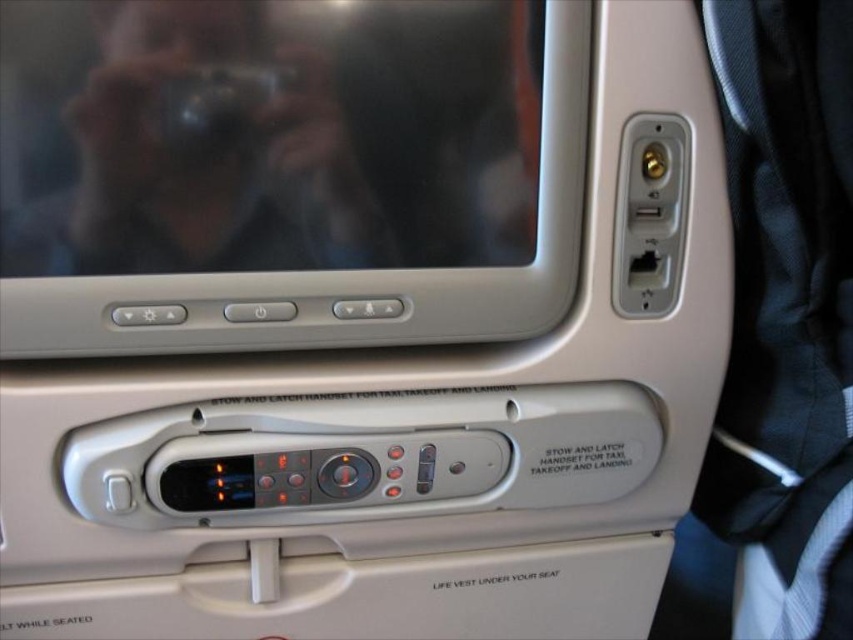
Which is in front, point (245, 284) or point (257, 86)?

Point (257, 86) is more forward.

Does point (135, 289) lie in front of point (163, 115)?

That is False.

This screenshot has width=853, height=640. Describe the element at coordinates (345, 269) in the screenshot. I see `satin silver screen at upper center` at that location.

You are a GUI agent. You are given a task and a screenshot of the screen. Output one action in this format:
    pyautogui.click(x=<x>, y=<y>)
    Task: Click on the satin silver screen at upper center
    Image resolution: width=853 pixels, height=640 pixels.
    Given the screenshot: What is the action you would take?
    pyautogui.click(x=345, y=269)

Is metallic silver camera at upper left thinner than metallic black camera at upper center?

Incorrect, metallic silver camera at upper left's width is not less than metallic black camera at upper center's.

Between point (268, 136) and point (277, 84), which one is positioned in front?

Positioned in front is point (277, 84).

Between point (320, 128) and point (196, 134), which one is positioned in front?

Point (196, 134) is more forward.

Identify the location of metallic silver camera at upper left. (215, 148).

Is metallic silver camera at upper left to the left of satin silver screen at upper center from the viewer's perspective?

Yes, metallic silver camera at upper left is to the left of satin silver screen at upper center.

Can you confirm if metallic silver camera at upper left is positioned to the right of satin silver screen at upper center?

Incorrect, metallic silver camera at upper left is not on the right side of satin silver screen at upper center.

The image size is (853, 640). What do you see at coordinates (215, 148) in the screenshot? I see `metallic silver camera at upper left` at bounding box center [215, 148].

Where is `metallic silver camera at upper left`? The width and height of the screenshot is (853, 640). metallic silver camera at upper left is located at coordinates (215, 148).